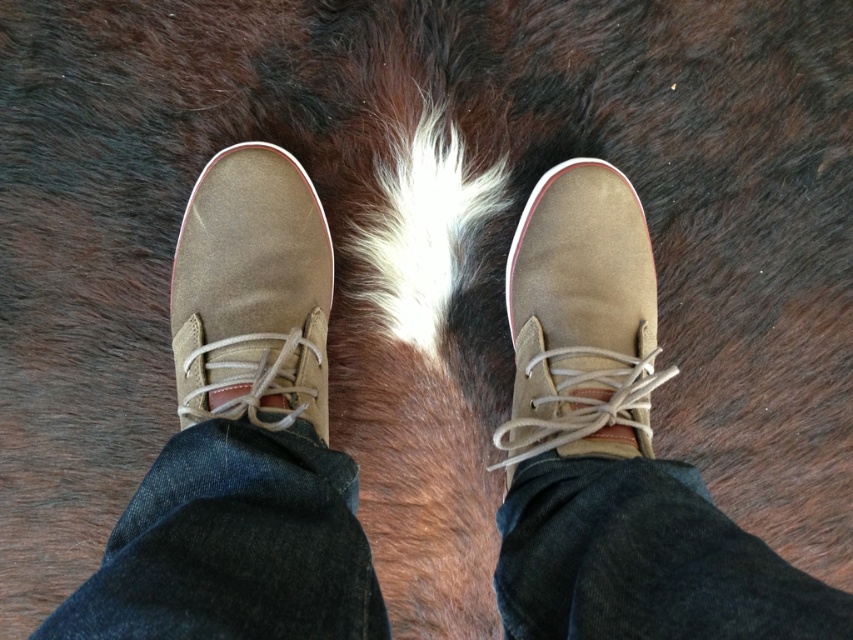
Question: Among these objects, which one is farthest from the camera?

Choices:
 (A) suede shoe at center
 (B) suede/leather boot at center

Answer: (B)

Question: Among these objects, which one is farthest from the camera?

Choices:
 (A) suede shoe at center
 (B) suede/leather boot at center

Answer: (B)

Question: Can you confirm if suede/leather boot at center is positioned above suede shoe at center?

Choices:
 (A) no
 (B) yes

Answer: (A)

Question: Is suede/leather boot at center to the right of suede shoe at center from the viewer's perspective?

Choices:
 (A) yes
 (B) no

Answer: (A)

Question: Is suede/leather boot at center to the right of suede shoe at center from the viewer's perspective?

Choices:
 (A) yes
 (B) no

Answer: (A)